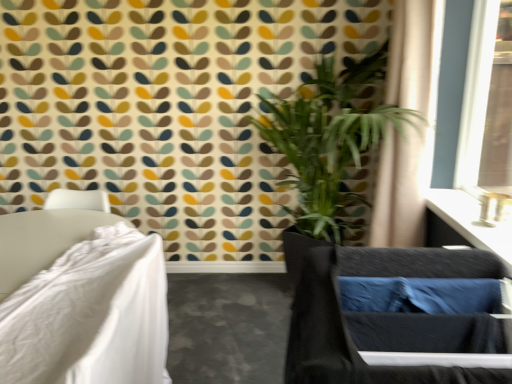
What do you see at coordinates (121, 320) in the screenshot? I see `white fabric bed at left` at bounding box center [121, 320].

What do you see at coordinates (329, 146) in the screenshot? This screenshot has width=512, height=384. I see `green leafy plant at center` at bounding box center [329, 146].

What do you see at coordinates (382, 316) in the screenshot? Image resolution: width=512 pixels, height=384 pixels. I see `black fabric swivel chair at lower right` at bounding box center [382, 316].

Find the location of a particular element. This screenshot has width=512, height=384. white fabric bed at left is located at coordinates (121, 320).

I want to click on swivel chair that is in front of the beige fabric curtain at upper right, so click(382, 316).

Which object is further away from the camera taking this photo, beige fabric curtain at upper right or black fabric swivel chair at lower right?

Positioned behind is beige fabric curtain at upper right.

From a real-world perspective, is beige fabric curtain at upper right physically above black fabric swivel chair at lower right?

Yes.

From the image's perspective, which is below, beige fabric curtain at upper right or black fabric swivel chair at lower right?

black fabric swivel chair at lower right appears lower in the image.

Where is `vanity behind the white fabric bed at left`? This screenshot has width=512, height=384. vanity behind the white fabric bed at left is located at coordinates [x=471, y=222].

From the image's perspective, is satin black vanity at upper right positioned above or below white fabric bed at left?

Clearly, from the image's perspective, satin black vanity at upper right is above white fabric bed at left.

Can you confirm if satin black vanity at upper right is wider than white fabric bed at left?

Incorrect, the width of satin black vanity at upper right does not surpass that of white fabric bed at left.

From the image's perspective, which object appears higher, beige fabric curtain at upper right or satin black vanity at upper right?

beige fabric curtain at upper right, from the image's perspective.

Considering the relative sizes of beige fabric curtain at upper right and satin black vanity at upper right in the image provided, is beige fabric curtain at upper right thinner than satin black vanity at upper right?

In fact, beige fabric curtain at upper right might be wider than satin black vanity at upper right.

Are beige fabric curtain at upper right and satin black vanity at upper right located far from each other?

No, beige fabric curtain at upper right is in close proximity to satin black vanity at upper right.

Consider the image. Considering the relative sizes of beige fabric curtain at upper right and satin black vanity at upper right in the image provided, is beige fabric curtain at upper right bigger than satin black vanity at upper right?

Correct, beige fabric curtain at upper right is larger in size than satin black vanity at upper right.

Could you tell me if satin black vanity at upper right is facing beige fabric curtain at upper right?

No, satin black vanity at upper right is not aimed at beige fabric curtain at upper right.

How many degrees apart are the facing directions of satin black vanity at upper right and beige fabric curtain at upper right?

The angular difference between satin black vanity at upper right and beige fabric curtain at upper right is 0.823 degrees.

Consider the image. Which of these two, satin black vanity at upper right or beige fabric curtain at upper right, is thinner?

satin black vanity at upper right.

Looking at this image, is satin black vanity at upper right taller than beige fabric curtain at upper right?

No.

Is white fabric bed at left not inside satin black vanity at upper right?

Absolutely, white fabric bed at left is external to satin black vanity at upper right.

Is white fabric bed at left far away from satin black vanity at upper right?

Indeed, white fabric bed at left is not near satin black vanity at upper right.

In the scene shown: Considering the relative sizes of white fabric bed at left and satin black vanity at upper right in the image provided, is white fabric bed at left taller than satin black vanity at upper right?

Indeed, white fabric bed at left has a greater height compared to satin black vanity at upper right.

Who is more distant, white fabric bed at left or satin black vanity at upper right?

satin black vanity at upper right is further from the camera.

Is black fabric swivel chair at lower right oriented towards white fabric bed at left?

Yes, black fabric swivel chair at lower right is turned towards white fabric bed at left.

How distant is black fabric swivel chair at lower right from white fabric bed at left?

The distance of black fabric swivel chair at lower right from white fabric bed at left is 24.76 inches.

Is black fabric swivel chair at lower right far away from white fabric bed at left?

black fabric swivel chair at lower right is actually quite close to white fabric bed at left.

Is black fabric swivel chair at lower right taller than white fabric bed at left?

Incorrect, the height of black fabric swivel chair at lower right is not larger of that of white fabric bed at left.

Do you think green leafy plant at center is within white fabric bed at left, or outside of it?

green leafy plant at center is spatially situated outside white fabric bed at left.

From a real-world perspective, is green leafy plant at center positioned above or below white fabric bed at left?

Clearly, from a real-world perspective, green leafy plant at center is above white fabric bed at left.

Is green leafy plant at center facing towards white fabric bed at left?

No, green leafy plant at center is not turned towards white fabric bed at left.

Does green leafy plant at center have a greater height compared to white fabric bed at left?

Yes.

This screenshot has height=384, width=512. Find the location of `curtain on the right of black fabric swivel chair at lower right`. curtain on the right of black fabric swivel chair at lower right is located at coordinates (408, 127).

The width and height of the screenshot is (512, 384). What are the coordinates of `furniture on the left of satin black vanity at upper right` in the screenshot? It's located at (121, 320).

Looking at the image, which one is located further to black fabric swivel chair at lower right, green leafy plant at center or white fabric bed at left?

green leafy plant at center is further to black fabric swivel chair at lower right.

Considering their positions, is green leafy plant at center positioned closer to beige fabric curtain at upper right than black fabric swivel chair at lower right?

green leafy plant at center is closer to beige fabric curtain at upper right.

From the image, which object appears to be nearer to satin black vanity at upper right, black fabric swivel chair at lower right or white fabric bed at left?

Based on the image, black fabric swivel chair at lower right appears to be nearer to satin black vanity at upper right.

Estimate the real-world distances between objects in this image. Which object is closer to satin black vanity at upper right, white fabric bed at left or black fabric swivel chair at lower right?

black fabric swivel chair at lower right is closer to satin black vanity at upper right.

In the scene shown: Which object lies nearer to the anchor point satin black vanity at upper right, green leafy plant at center or white fabric bed at left?

green leafy plant at center lies closer to satin black vanity at upper right than the other object.

Based on the photo, based on their spatial positions, is black fabric swivel chair at lower right or white fabric bed at left further from green leafy plant at center?

black fabric swivel chair at lower right is positioned further to the anchor green leafy plant at center.

Considering their positions, is beige fabric curtain at upper right positioned further to white fabric bed at left than green leafy plant at center?

Among the two, beige fabric curtain at upper right is located further to white fabric bed at left.

When comparing their distances from satin black vanity at upper right, does black fabric swivel chair at lower right or green leafy plant at center seem closer?

green leafy plant at center is positioned closer to the anchor satin black vanity at upper right.

The width and height of the screenshot is (512, 384). Identify the location of vanity between black fabric swivel chair at lower right and green leafy plant at center along the z-axis. (471, 222).

The width and height of the screenshot is (512, 384). In order to click on curtain located between white fabric bed at left and satin black vanity at upper right in the left-right direction in this screenshot , I will do `click(408, 127)`.

Where is `curtain between green leafy plant at center and satin black vanity at upper right`? The image size is (512, 384). curtain between green leafy plant at center and satin black vanity at upper right is located at coordinates (408, 127).

The width and height of the screenshot is (512, 384). In order to click on houseplant located between white fabric bed at left and satin black vanity at upper right in the left-right direction in this screenshot , I will do `click(329, 146)`.